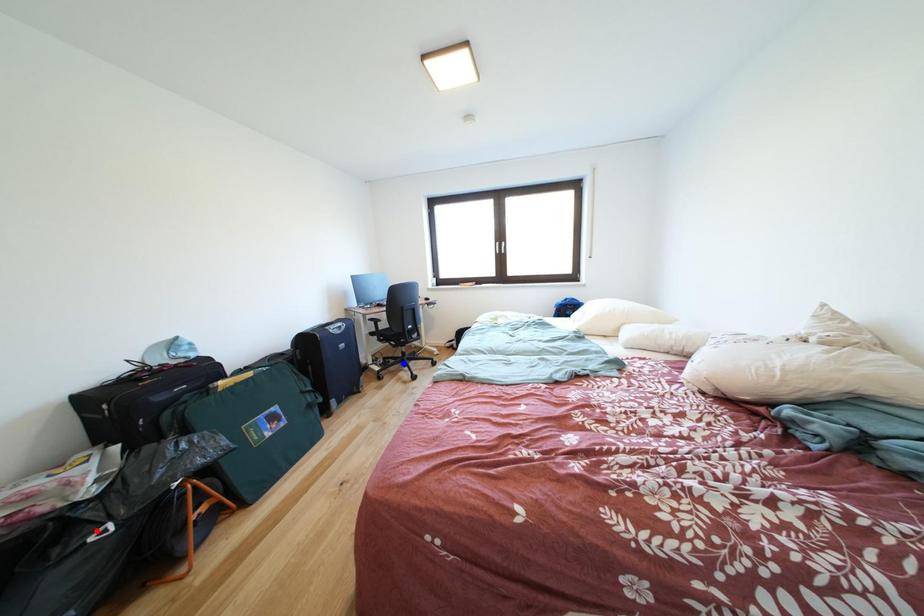
Question: Which of the two points in the image is closer to the camera?

Choices:
 (A) Blue point is closer.
 (B) Red point is closer.

Answer: (B)